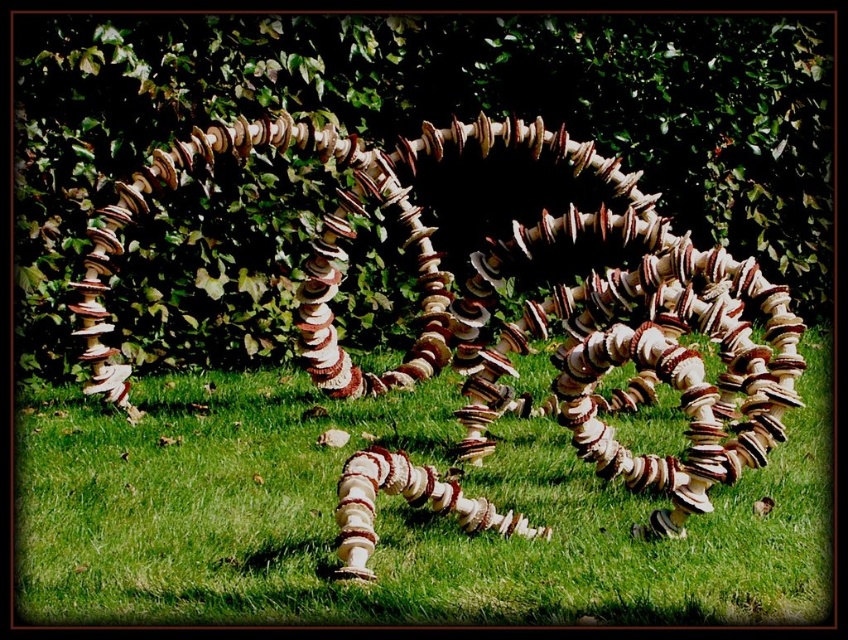
Between green leafy hedge at center and white textured mushrooms at center, which one is positioned lower?

white textured mushrooms at center

Which of these two, green leafy hedge at center or white textured mushrooms at center, stands taller?

Standing taller between the two is green leafy hedge at center.

The image size is (848, 640). What do you see at coordinates (434, 118) in the screenshot?
I see `green leafy hedge at center` at bounding box center [434, 118].

Locate an element on the screen. green leafy hedge at center is located at coordinates (434, 118).